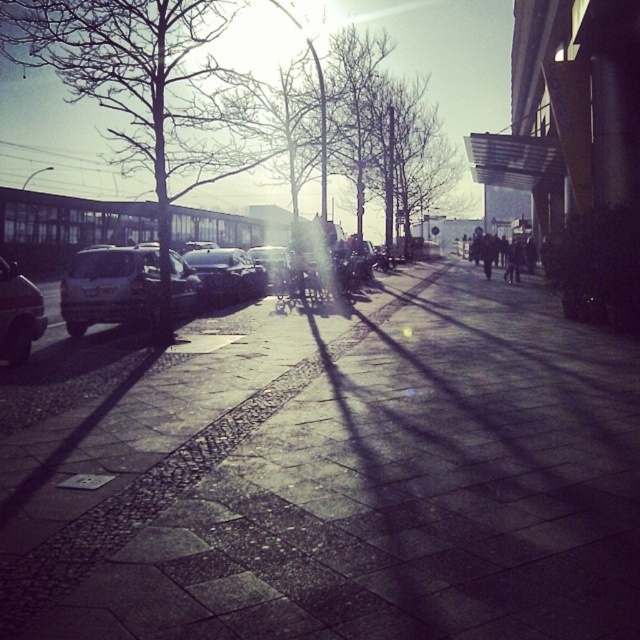
Question: Which of the following is the closest to the observer?

Choices:
 (A) (504, 273)
 (B) (532, 528)

Answer: (B)

Question: Among these objects, which one is nearest to the camera?

Choices:
 (A) matte silver car at left
 (B) matte black car at left
 (C) shiny silver car at center-left
 (D) bare branches at left

Answer: (B)

Question: Is paved stone sidewalk at center positioned behind dark clothing figure at center-right?

Choices:
 (A) yes
 (B) no

Answer: (B)

Question: Which point is farther to the camera?

Choices:
 (A) paved stone sidewalk at center
 (B) bare branches at left

Answer: (B)

Question: In this image, where is matte silver car at left located relative to matte black car at left?

Choices:
 (A) above
 (B) below

Answer: (B)

Question: Can you confirm if paved stone sidewalk at center is positioned below matte silver car at left?

Choices:
 (A) no
 (B) yes

Answer: (B)